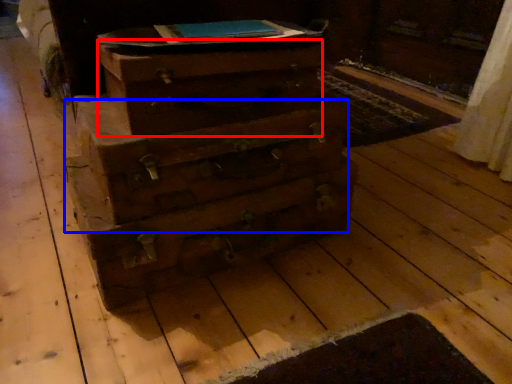
Question: Which object appears farthest to the camera in this image, drawer (highlighted by a red box) or drawer (highlighted by a blue box)?

Choices:
 (A) drawer
 (B) drawer

Answer: (B)